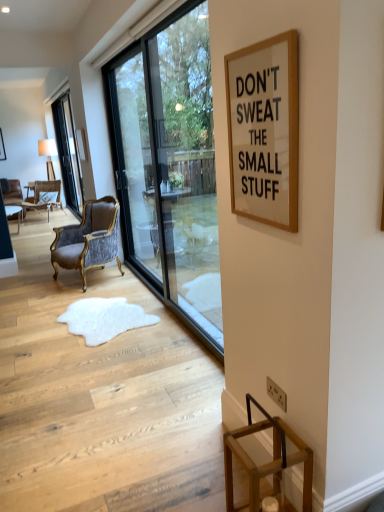
You are a GUI agent. You are given a task and a screenshot of the screen. Output one action in this format:
    pyautogui.click(x=<x>, y=<y>)
    Task: Click on the velvet upholstered chair at left, placed as the first chair when sorted from left to right
    The height and width of the screenshot is (512, 384).
    Given the screenshot: What is the action you would take?
    pyautogui.click(x=45, y=196)

Measure the distance between point (20, 212) and camera.

Point (20, 212) and camera are 7.51 meters apart.

This screenshot has height=512, width=384. What are the coordinates of `wooden table at left` in the screenshot? It's located at (14, 213).

How much space does transparent glass window at center, which appears as the first window when viewed from the right, occupy horizontally?

It is 4.90 inches.

Find the location of a particular element. Image resolution: width=384 pixels, height=512 pixels. white fur rug at center is located at coordinates (104, 318).

What do you see at coordinates (139, 165) in the screenshot?
I see `transparent glass screen door at center` at bounding box center [139, 165].

You are a GUI agent. You are given a task and a screenshot of the screen. Output one action in this format:
    pyautogui.click(x=<x>, y=<y>)
    Task: Click on the white paperboard at upper right
    The height and width of the screenshot is (512, 384).
    Given the screenshot: What is the action you would take?
    pyautogui.click(x=264, y=130)

You are a GUI agent. You are given a task and a screenshot of the screen. Output one action in this format:
    pyautogui.click(x=<x>, y=<y>)
    Task: Click on the velvet upholstered chair at left, placed as the first chair when sorted from left to right
    This screenshot has width=384, height=512.
    Given the screenshot: What is the action you would take?
    pyautogui.click(x=45, y=196)

Can you confirm if transparent glass window at center, which appears as the first window when viewed from the right, is positioned to the right of velvet upholstered armchair at center, positioned as the 2th chair in left-to-right order?

Indeed, transparent glass window at center, which appears as the first window when viewed from the right, is positioned on the right side of velvet upholstered armchair at center, positioned as the 2th chair in left-to-right order.

Who is more distant, transparent glass window at center, which appears as the first window when viewed from the right, or velvet upholstered armchair at center, positioned as the 2th chair in left-to-right order?

velvet upholstered armchair at center, positioned as the 2th chair in left-to-right order.

Identify the location of window that is the 1st one when counting upward from the velvet upholstered armchair at center, which appears as the 1th chair when viewed from the front (from the image's perspective). The image size is (384, 512). (169, 165).

Which point is more forward, [192,286] or [117,233]?

Positioned in front is point [192,286].

Is clear glass window at left, acting as the 2th window starting from the right, smaller than white paperboard at upper right?

Incorrect, clear glass window at left, acting as the 2th window starting from the right, is not smaller in size than white paperboard at upper right.

From the image's perspective, is clear glass window at left, which is the first window from left to right, over white paperboard at upper right?

Correct, clear glass window at left, which is the first window from left to right, appears higher than white paperboard at upper right in the image.

From a real-world perspective, is clear glass window at left, the first window in the back-to-front sequence, above or below white paperboard at upper right?

In terms of real-world spatial position, clear glass window at left, the first window in the back-to-front sequence, is below white paperboard at upper right.

Is clear glass window at left, acting as the 2th window starting from the right, not near white paperboard at upper right?

Yes, clear glass window at left, acting as the 2th window starting from the right, and white paperboard at upper right are located far from each other.

Between point (74, 141) and point (44, 205), which one is positioned behind?

Positioned behind is point (44, 205).

Between clear glass window at left, the first window in the back-to-front sequence, and velvet upholstered chair at left, the second chair from the front, which one is positioned behind?

velvet upholstered chair at left, the second chair from the front, is further away from the camera.

Is clear glass window at left, acting as the 2th window starting from the right, next to velvet upholstered chair at left, the second chair from the front?

clear glass window at left, acting as the 2th window starting from the right, and velvet upholstered chair at left, the second chair from the front, are clearly separated.

Considering the sizes of objects clear glass window at left, acting as the 2th window starting from the right, and velvet upholstered chair at left, which is the first chair in top-to-bottom order, in the image provided, who is bigger, clear glass window at left, acting as the 2th window starting from the right, or velvet upholstered chair at left, which is the first chair in top-to-bottom order,?

clear glass window at left, acting as the 2th window starting from the right, is bigger.

Which of these two, transparent glass screen door at center or white fur rug at center, stands shorter?

With less height is white fur rug at center.

Which is in front, point (136, 193) or point (110, 326)?

Point (110, 326)

Measure the distance between transparent glass screen door at center and white fur rug at center.

A distance of 1.23 meters exists between transparent glass screen door at center and white fur rug at center.

How different are the orientations of transparent glass screen door at center and white fur rug at center in degrees?

transparent glass screen door at center and white fur rug at center are facing 14.2 degrees away from each other.

Considering the relative positions of clear glass window at left, acting as the 2th window starting from the right, and wooden table at left in the image provided, is clear glass window at left, acting as the 2th window starting from the right, in front of wooden table at left?

No, clear glass window at left, acting as the 2th window starting from the right, is further to the viewer.

Are clear glass window at left, which is the first window from left to right, and wooden table at left beside each other?

There is a gap between clear glass window at left, which is the first window from left to right, and wooden table at left.

I want to click on window that is the 2nd one above the wooden table at left (from a real-world perspective), so click(x=68, y=153).

Looking at this image, from the image's perspective, relative to wooden table at left, is clear glass window at left, which is counted as the 2th window, starting from the front, above or below?

From the image's perspective, clear glass window at left, which is counted as the 2th window, starting from the front, appears above wooden table at left.

Which object is positioned more to the right, velvet upholstered chair at left, placed as the first chair when sorted from left to right, or transparent glass window at center, which appears as the first window when viewed from the right?

transparent glass window at center, which appears as the first window when viewed from the right.

From the image's perspective, between velvet upholstered chair at left, placed as the first chair when sorted from left to right, and transparent glass window at center, arranged as the 2th window when viewed from the back, who is located below?

transparent glass window at center, arranged as the 2th window when viewed from the back, is shown below in the image.

What's the angular difference between velvet upholstered chair at left, which is the 2th chair in bottom-to-top order, and transparent glass window at center, arranged as the 2th window when viewed from the back,'s facing directions?

56.9 degrees separate the facing orientations of velvet upholstered chair at left, which is the 2th chair in bottom-to-top order, and transparent glass window at center, arranged as the 2th window when viewed from the back.

From a real-world perspective, who is located lower, velvet upholstered chair at left, placed as the first chair when sorted from left to right, or transparent glass window at center, arranged as the 2th window when viewed from the back?

From a 3D spatial view, velvet upholstered chair at left, placed as the first chair when sorted from left to right, is below.

Looking at this image, considering the sizes of objects white paperboard at upper right and transparent glass window at center, which appears as the first window when viewed from the right, in the image provided, who is bigger, white paperboard at upper right or transparent glass window at center, which appears as the first window when viewed from the right,?

With larger size is transparent glass window at center, which appears as the first window when viewed from the right.

Is the position of white paperboard at upper right more distant than that of transparent glass window at center, which appears as the first window when viewed from the right?

No, it is not.

What's the angular difference between white paperboard at upper right and transparent glass window at center, which is counted as the first window, starting from the front,'s facing directions?

The angular difference between white paperboard at upper right and transparent glass window at center, which is counted as the first window, starting from the front, is 0.19 degrees.

From a real-world perspective, count 1st windows upward from the velvet upholstered armchair at center, which appears as the first chair when viewed from the right, and point to it. Please provide its 2D coordinates.

[(169, 165)]

At what (x,y) coordinates should I click in order to perform the action: click on bulletin board in front of the clear glass window at left, the first window in the back-to-front sequence. Please return your answer as a coordinate pair (x, y). The height and width of the screenshot is (512, 384). Looking at the image, I should click on (264, 130).

Which object lies further to the anchor point transparent glass screen door at center, transparent glass window at center, which appears as the first window when viewed from the right, or wooden picture frame at upper left?

wooden picture frame at upper left.

Consider the image. Estimate the real-world distances between objects in this image. Which object is closer to transparent glass screen door at center, velvet upholstered armchair at center, which appears as the 1th chair when ordered from the bottom, or white paperboard at upper right?

velvet upholstered armchair at center, which appears as the 1th chair when ordered from the bottom, is closer to transparent glass screen door at center.

Looking at the image, which one is located closer to white paperboard at upper right, wooden picture frame at upper left or wooden table at left?

Among the two, wooden table at left is located nearer to white paperboard at upper right.

Looking at the image, which one is located further to white fur rug at center, clear glass window at left, acting as the 2th window starting from the right, or velvet upholstered armchair at center, which appears as the 1th chair when ordered from the bottom?

The object further to white fur rug at center is clear glass window at left, acting as the 2th window starting from the right.

Considering their positions, is white fur rug at center positioned closer to velvet upholstered chair at left, which is the first chair in top-to-bottom order, than transparent glass window at center, which is counted as the first window, starting from the front?

transparent glass window at center, which is counted as the first window, starting from the front.

Which object lies nearer to the anchor point wooden table at left, transparent glass screen door at center or transparent glass window at center, arranged as the 2th window when viewed from the back?

transparent glass screen door at center is positioned closer to the anchor wooden table at left.

When comparing their distances from transparent glass screen door at center, does velvet upholstered armchair at center, which appears as the first chair when viewed from the right, or white fur rug at center seem further?

white fur rug at center.

Based on their spatial positions, is transparent glass screen door at center or white fur rug at center further from velvet upholstered armchair at center, which appears as the 1th chair when viewed from the front?

Based on the image, white fur rug at center appears to be further to velvet upholstered armchair at center, which appears as the 1th chair when viewed from the front.

At what (x,y) coordinates should I click in order to perform the action: click on table between velvet upholstered armchair at center, which appears as the 1th chair when ordered from the bottom, and wooden picture frame at upper left, along the z-axis. Please return your answer as a coordinate pair (x, y). The height and width of the screenshot is (512, 384). Looking at the image, I should click on pos(14,213).

Where is `chair positioned between white paperboard at upper right and velvet upholstered chair at left, positioned as the 1th chair in back-to-front order, from near to far`? This screenshot has height=512, width=384. chair positioned between white paperboard at upper right and velvet upholstered chair at left, positioned as the 1th chair in back-to-front order, from near to far is located at coordinates (88, 239).

Where is `doormat positioned between white paperboard at upper right and wooden table at left from near to far`? The width and height of the screenshot is (384, 512). doormat positioned between white paperboard at upper right and wooden table at left from near to far is located at coordinates (104, 318).

Identify the location of doormat located between transparent glass window at center, acting as the second window starting from the left, and wooden picture frame at upper left in the depth direction. (104, 318).